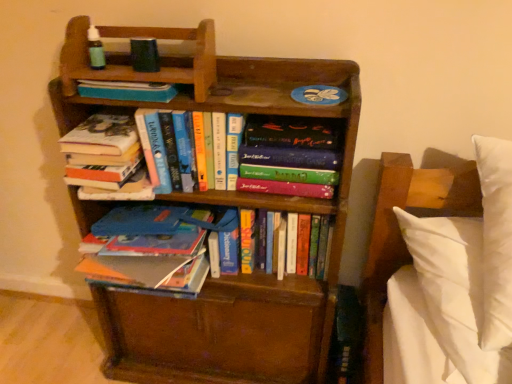
Question: Is hardcover book at center, placed as the third book when sorted from right to left, facing towards hardcover book at upper center, the 2th book positioned from the left?

Choices:
 (A) yes
 (B) no

Answer: (B)

Question: Is hardcover book at center, acting as the 3th book starting from the left, positioned behind hardcover book at upper center, the 2th book positioned from the left?

Choices:
 (A) no
 (B) yes

Answer: (A)

Question: Does hardcover book at center, placed as the third book when sorted from right to left, appear on the right side of hardcover book at upper center, the 2th book positioned from the left?

Choices:
 (A) no
 (B) yes

Answer: (B)

Question: Would you say hardcover book at upper center, positioned as the fourth book in right-to-left order, is part of hardcover book at center, placed as the third book when sorted from right to left,'s contents?

Choices:
 (A) no
 (B) yes

Answer: (A)

Question: Is hardcover book at center, acting as the 3th book starting from the left, positioned with its back to hardcover book at upper center, positioned as the fourth book in right-to-left order?

Choices:
 (A) yes
 (B) no

Answer: (B)

Question: In terms of height, does wooden bookcase at center look taller or shorter compared to hardcover book at upper center, positioned as the fourth book in right-to-left order?

Choices:
 (A) short
 (B) tall

Answer: (B)

Question: From the image's perspective, is wooden bookcase at center located above or below hardcover book at upper center, positioned as the fourth book in right-to-left order?

Choices:
 (A) above
 (B) below

Answer: (B)

Question: Based on their sizes in the image, would you say wooden bookcase at center is bigger or smaller than hardcover book at upper center, positioned as the fourth book in right-to-left order?

Choices:
 (A) big
 (B) small

Answer: (A)

Question: Does point (220, 109) appear closer or farther from the camera than point (145, 99)?

Choices:
 (A) closer
 (B) farther

Answer: (A)

Question: From a real-world perspective, relative to hardcover book at center, the 2th book positioned from the right, is hardcover book at center, the 5th book when ordered from left to right, vertically above or below?

Choices:
 (A) below
 (B) above

Answer: (B)

Question: Does point (284, 155) appear closer or farther from the camera than point (327, 228)?

Choices:
 (A) closer
 (B) farther

Answer: (A)

Question: Based on their positions, is hardcover book at center, marked as the 1th book in a right-to-left arrangement, located to the left or right of hardcover book at center, the 2th book positioned from the right?

Choices:
 (A) right
 (B) left

Answer: (A)

Question: From the image's perspective, relative to hardcover book at center, the 2th book positioned from the right, is hardcover book at center, marked as the 1th book in a right-to-left arrangement, above or below?

Choices:
 (A) below
 (B) above

Answer: (B)

Question: Considering the relative positions of hardcover book at upper center, positioned as the fourth book in right-to-left order, and wooden bookcase at center in the image provided, is hardcover book at upper center, positioned as the fourth book in right-to-left order, to the left or to the right of wooden bookcase at center?

Choices:
 (A) right
 (B) left

Answer: (B)

Question: Is point (80, 89) positioned closer to the camera than point (344, 87)?

Choices:
 (A) farther
 (B) closer

Answer: (B)